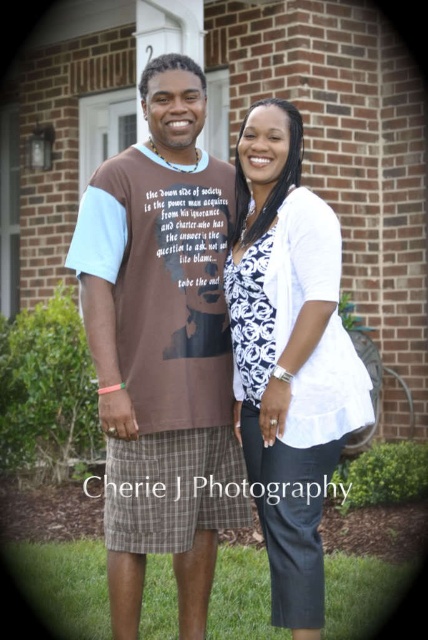
Question: Is the position of brown cotton t-shirt at center more distant than that of white textured blouse at center?

Choices:
 (A) no
 (B) yes

Answer: (B)

Question: Which object is farther from the camera taking this photo?

Choices:
 (A) white textured blouse at center
 (B) brown cotton t-shirt at center

Answer: (B)

Question: Can you confirm if brown cotton t-shirt at center is positioned above white textured blouse at center?

Choices:
 (A) yes
 (B) no

Answer: (A)

Question: Which of the following is the closest to the observer?

Choices:
 (A) white textured blouse at center
 (B) brown cotton t-shirt at center

Answer: (A)

Question: Is brown cotton t-shirt at center bigger than white textured blouse at center?

Choices:
 (A) yes
 (B) no

Answer: (A)